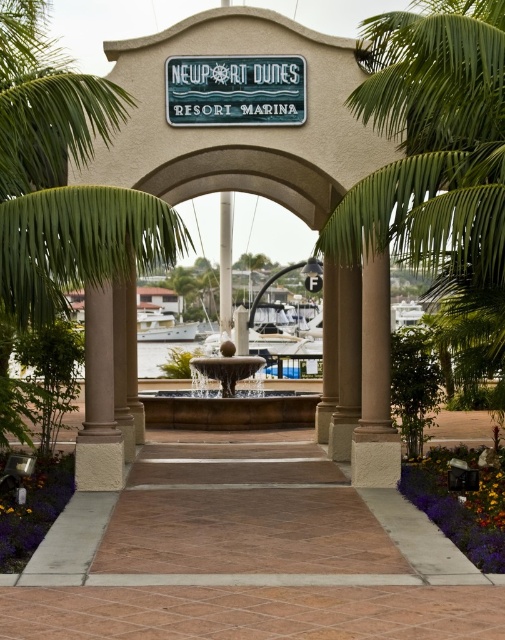
You are standing at the entrance of Newport Dunes Resort Marina and notice two points marked on the ground in front of the archway. The first point is at coordinates point [191,387] and the second is at point [226,337]. Which of these two points is closer to you?

Point [191,387] is closer to the viewer than point [226,337].

In the scene shown: You are designing a layout for a new sign that needs to be placed near the teal matte sign at center and the beige stone pillar at center. Given their sizes, which object should you consider as the primary anchor point for positioning the new sign?

The beige stone pillar at center should be considered the primary anchor point because it occupies more space than the teal matte sign at center, making it a more stable reference point for positioning the new sign.

You are planning to place a new decorative statue that is 2 meters wide in the Newport Dunes Resort Marina entrance. The statue must be placed either next to the smooth stone fountain at center or next to the beige stone pillar at center. Based on the current layout, which location has enough space for the statue?

The smooth stone fountain at center has a greater width than the beige stone pillar at center. Since the statue is 2 meters wide, it would require a space at least as wide as itself. The smooth stone fountain at center, being wider, likely provides sufficient space for the statue compared to the narrower beige stone pillar at center.